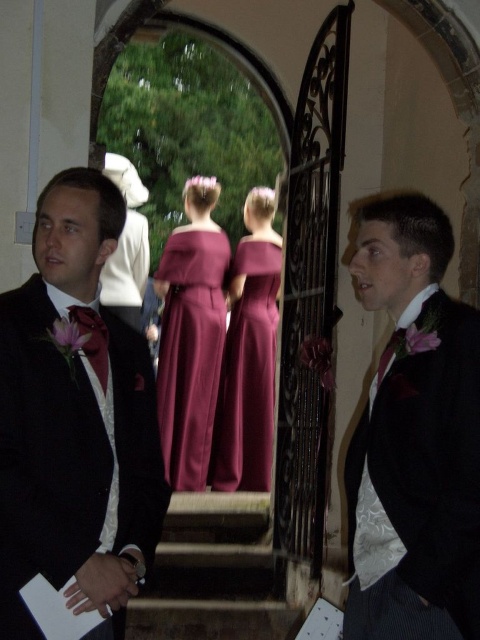
Question: Among these objects, which one is farthest from the camera?

Choices:
 (A) burgundy satin dress at center
 (B) velvet burgundy vest at right
 (C) burgundy satin dresses at center

Answer: (A)

Question: Which of the following is the farthest from the observer?

Choices:
 (A) (206, 577)
 (B) (239, 378)

Answer: (B)

Question: Can you confirm if matte black suit at left is positioned below matte burgundy dress at center?

Choices:
 (A) no
 (B) yes

Answer: (B)

Question: Is burgundy satin dresses at center wider than matte burgundy dress at center?

Choices:
 (A) no
 (B) yes

Answer: (B)

Question: Is velvet burgundy vest at right to the left of burgundy satin dresses at center from the viewer's perspective?

Choices:
 (A) no
 (B) yes

Answer: (A)

Question: Among these objects, which one is nearest to the camera?

Choices:
 (A) matte burgundy dress at center
 (B) burgundy satin dresses at center

Answer: (A)